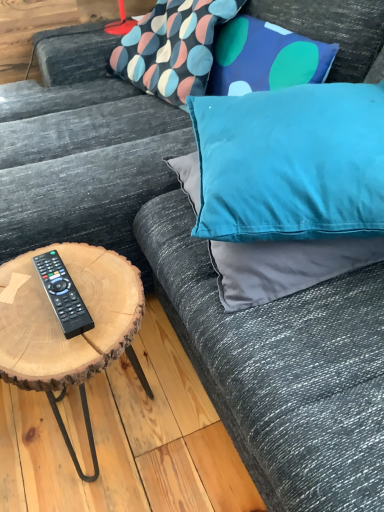
Question: Is natural wood coffee table at left shorter than teal fabric pillow at upper right, the third pillow positioned from the top?

Choices:
 (A) yes
 (B) no

Answer: (B)

Question: Is natural wood coffee table at left located outside teal fabric pillow at upper right, the third pillow positioned from the top?

Choices:
 (A) yes
 (B) no

Answer: (A)

Question: From a real-world perspective, is natural wood coffee table at left over teal fabric pillow at upper right, the third pillow positioned from the top?

Choices:
 (A) yes
 (B) no

Answer: (B)

Question: Is natural wood coffee table at left bigger than teal fabric pillow at upper right, the third pillow positioned from the top?

Choices:
 (A) yes
 (B) no

Answer: (B)

Question: Is teal fabric pillow at upper right, which is counted as the first pillow, starting from the bottom, located within natural wood coffee table at left?

Choices:
 (A) yes
 (B) no

Answer: (B)

Question: From the image's perspective, is textured fabric pillow at upper center, arranged as the third pillow when ordered from the bottom, located above or below teal satin pillow at upper right, which is the second pillow in bottom-to-top order?

Choices:
 (A) below
 (B) above

Answer: (B)

Question: In the image, is textured fabric pillow at upper center, arranged as the third pillow when ordered from the bottom, positioned in front of or behind teal satin pillow at upper right, which appears as the second pillow when viewed from the top?

Choices:
 (A) behind
 (B) front

Answer: (A)

Question: Is point (140, 33) closer or farther from the camera than point (256, 106)?

Choices:
 (A) farther
 (B) closer

Answer: (A)

Question: In the image, is textured fabric pillow at upper center, arranged as the third pillow when ordered from the bottom, on the left side or the right side of teal satin pillow at upper right, which appears as the second pillow when viewed from the top?

Choices:
 (A) left
 (B) right

Answer: (A)

Question: In terms of size, does natural wood coffee table at left appear bigger or smaller than teal fabric pillow at upper right, which is counted as the first pillow, starting from the bottom?

Choices:
 (A) big
 (B) small

Answer: (B)

Question: Visually, is natural wood coffee table at left positioned to the left or to the right of teal fabric pillow at upper right, which is counted as the first pillow, starting from the bottom?

Choices:
 (A) right
 (B) left

Answer: (B)

Question: Is natural wood coffee table at left spatially inside teal fabric pillow at upper right, the third pillow positioned from the top, or outside of it?

Choices:
 (A) inside
 (B) outside

Answer: (B)

Question: Is natural wood coffee table at left wider or thinner than teal fabric pillow at upper right, which is counted as the first pillow, starting from the bottom?

Choices:
 (A) wide
 (B) thin

Answer: (B)

Question: From the image's perspective, is teal fabric pillow at upper right, the third pillow positioned from the top, above or below teal satin pillow at upper right, which is the second pillow in bottom-to-top order?

Choices:
 (A) above
 (B) below

Answer: (B)

Question: Which is correct: teal fabric pillow at upper right, the third pillow positioned from the top, is inside teal satin pillow at upper right, which is the second pillow in bottom-to-top order, or outside of it?

Choices:
 (A) inside
 (B) outside

Answer: (A)